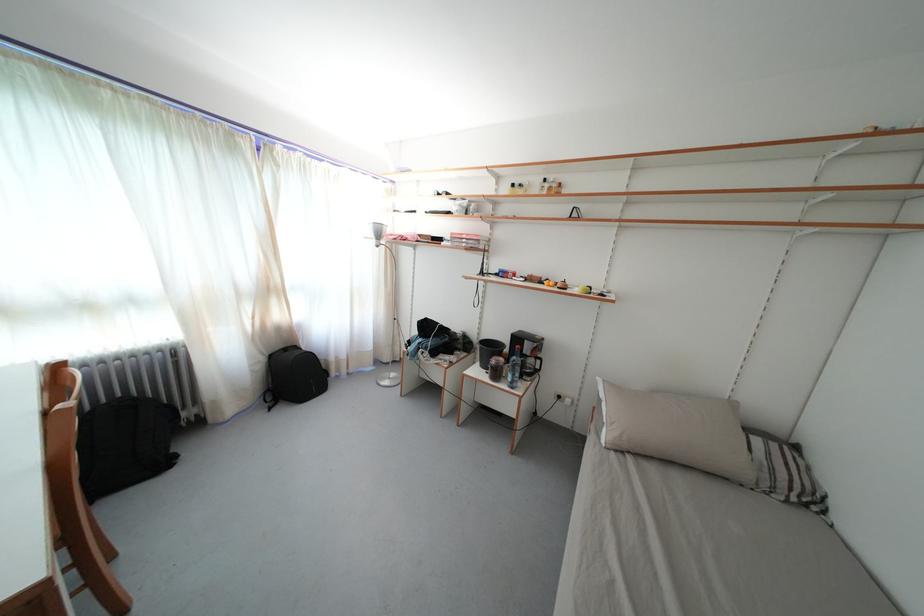
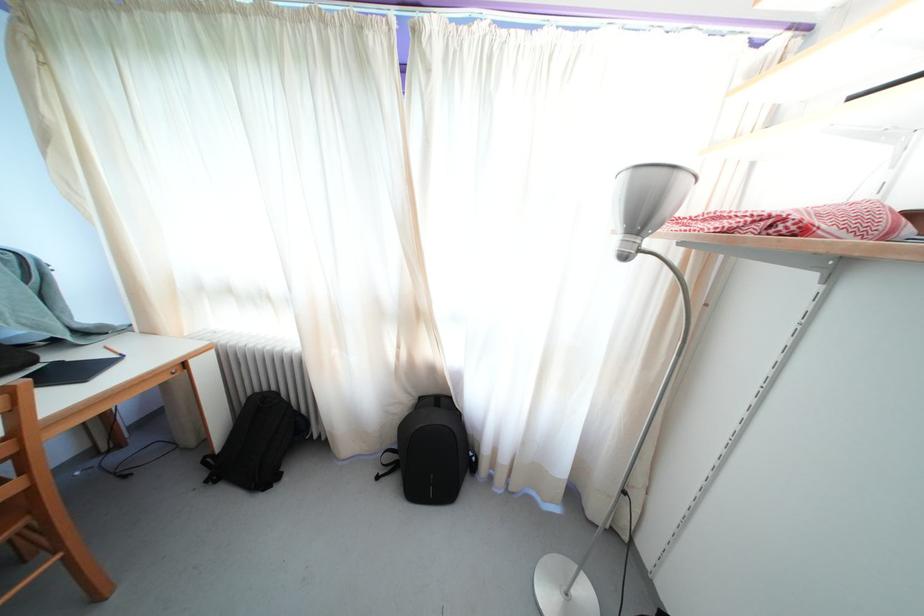
The point at (275, 296) is marked in the first image. Where is the corresponding point in the second image?

(421, 321)